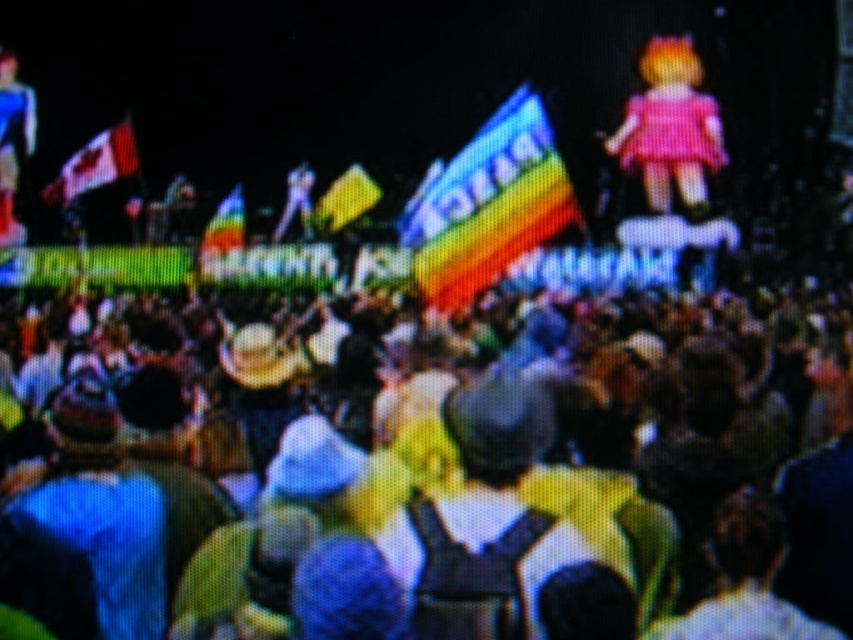
You are a photographer at the event and want to capture a photo that includes both the pink matte dress at upper right and the yellow fabric flag at upper center. Given that your camera has a maximum focus range of 100 feet, will you be able to include both in the same frame without moving closer?

The distance between the pink matte dress at upper right and the yellow fabric flag at upper center is 128.03 feet, which exceeds the camera maximum focus range of 100 feet. Therefore, you cannot include both in the same frame without moving closer.

You are a photographer at the event and want to capture a photo of the pink matte dress at upper right without the multicolored fabric crowd at center blocking it. What should you do?

The multicolored fabric crowd at center is taller than the pink matte dress at upper right, so you should lower your camera angle to avoid the crowd blocking the dress.

You are a photographer at the event and want to capture a photo of the pink matte dress at upper right. Since you can only focus on objects within a 0.15 meter radius, will the point at coordinates point (x=670, y=128) be within your focus range?

The point (x=670, y=128) corresponds to the pink matte dress at upper right, so yes, the focus will capture the pink matte dress at upper right as it is within the 0.15 meter radius.